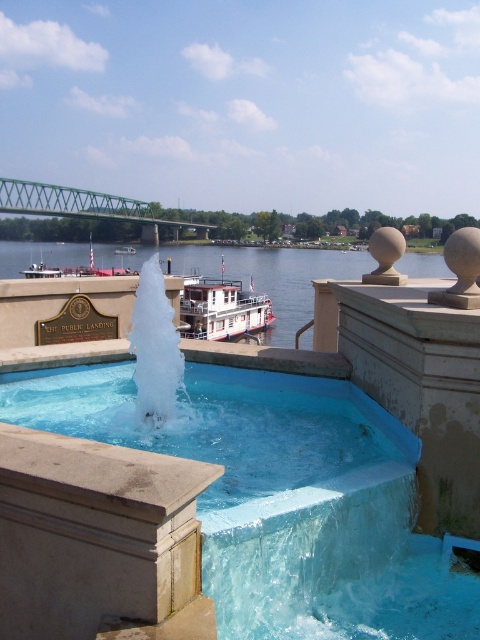
The height and width of the screenshot is (640, 480). I want to click on blue glossy fountain at center, so click(x=256, y=476).

Is point (331, 417) more distant than point (327, 272)?

No, (331, 417) is closer to viewer.

Identify the location of blue glossy fountain at center. tap(256, 476).

Can you confirm if blue water at center is wider than green metallic bridge at upper left?

Correct, the width of blue water at center exceeds that of green metallic bridge at upper left.

Is the position of blue water at center more distant than that of green metallic bridge at upper left?

No, blue water at center is closer to the viewer.

Is point (166, 250) more distant than point (140, 204)?

That is False.

The width and height of the screenshot is (480, 640). I want to click on blue water at center, so click(274, 275).

Which is behind, point (240, 596) or point (84, 211)?

The point (84, 211) is more distant.

Can you confirm if blue glossy fountain at center is positioned to the right of green metallic bridge at upper left?

Indeed, blue glossy fountain at center is positioned on the right side of green metallic bridge at upper left.

Locate an element on the screen. The width and height of the screenshot is (480, 640). blue glossy fountain at center is located at coordinates (256, 476).